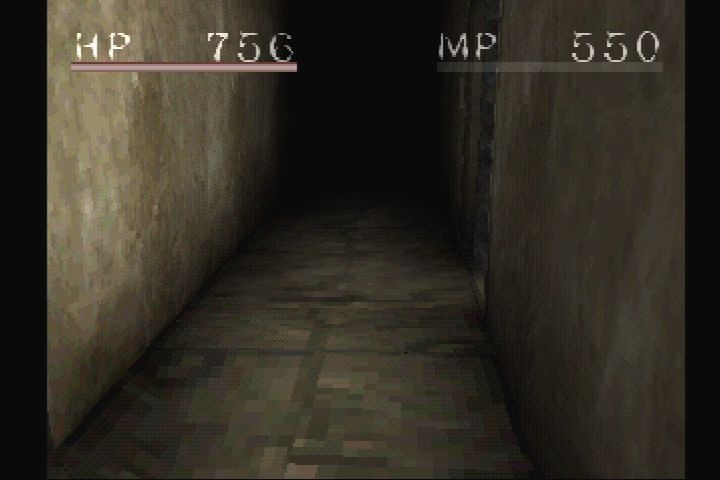
Identify the location of floor. The image size is (720, 480). (336, 290).